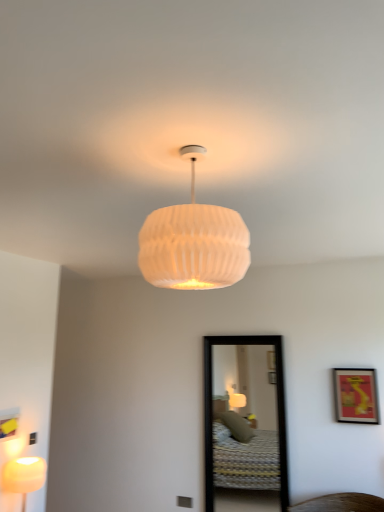
Question: From the image's perspective, is black-framed mirror at center above matte white lamp at lower left, positioned as the second lamp in top-to-bottom order?

Choices:
 (A) yes
 (B) no

Answer: (A)

Question: From a real-world perspective, is black-framed mirror at center on top of matte white lamp at lower left, positioned as the second lamp in top-to-bottom order?

Choices:
 (A) no
 (B) yes

Answer: (B)

Question: Considering the relative sizes of black-framed mirror at center and matte white lamp at lower left, which appears as the 1th lamp when ordered from the bottom, in the image provided, is black-framed mirror at center taller than matte white lamp at lower left, which appears as the 1th lamp when ordered from the bottom,?

Choices:
 (A) yes
 (B) no

Answer: (A)

Question: Is black-framed mirror at center positioned behind matte white lamp at lower left, marked as the 1th lamp in a back-to-front arrangement?

Choices:
 (A) no
 (B) yes

Answer: (B)

Question: From a real-world perspective, is black-framed mirror at center physically below matte white lamp at lower left, the second lamp when ordered from front to back?

Choices:
 (A) no
 (B) yes

Answer: (A)

Question: From a real-world perspective, relative to white ribbed shade at center, positioned as the 2th lamp in left-to-right order, is matte red picture frame at right vertically above or below?

Choices:
 (A) above
 (B) below

Answer: (B)

Question: Considering the relative positions of matte red picture frame at right and white ribbed shade at center, positioned as the 2th lamp in left-to-right order, in the image provided, is matte red picture frame at right to the left or to the right of white ribbed shade at center, positioned as the 2th lamp in left-to-right order,?

Choices:
 (A) right
 (B) left

Answer: (A)

Question: In terms of width, does matte red picture frame at right look wider or thinner when compared to white ribbed shade at center, the 1th lamp when ordered from right to left?

Choices:
 (A) wide
 (B) thin

Answer: (B)

Question: Is matte red picture frame at right situated inside white ribbed shade at center, placed as the first lamp when sorted from top to bottom, or outside?

Choices:
 (A) inside
 (B) outside

Answer: (B)

Question: In the image, is white ribbed shade at center, placed as the first lamp when sorted from top to bottom, positioned in front of or behind matte red picture frame at right?

Choices:
 (A) front
 (B) behind

Answer: (A)

Question: From a real-world perspective, is white ribbed shade at center, positioned as the 2th lamp in left-to-right order, positioned above or below matte red picture frame at right?

Choices:
 (A) above
 (B) below

Answer: (A)

Question: Would you say white ribbed shade at center, positioned as the 2th lamp in left-to-right order, is to the left or to the right of matte red picture frame at right in the picture?

Choices:
 (A) left
 (B) right

Answer: (A)

Question: Is white ribbed shade at center, which appears as the 1th lamp when viewed from the front, inside the boundaries of matte red picture frame at right, or outside?

Choices:
 (A) inside
 (B) outside

Answer: (B)

Question: From their relative heights in the image, would you say matte white lamp at lower left, which appears as the 1th lamp when ordered from the bottom, is taller or shorter than white ribbed shade at center, the 1th lamp when ordered from right to left?

Choices:
 (A) short
 (B) tall

Answer: (A)

Question: Considering the positions of point (36, 474) and point (213, 260), is point (36, 474) closer or farther from the camera than point (213, 260)?

Choices:
 (A) farther
 (B) closer

Answer: (A)